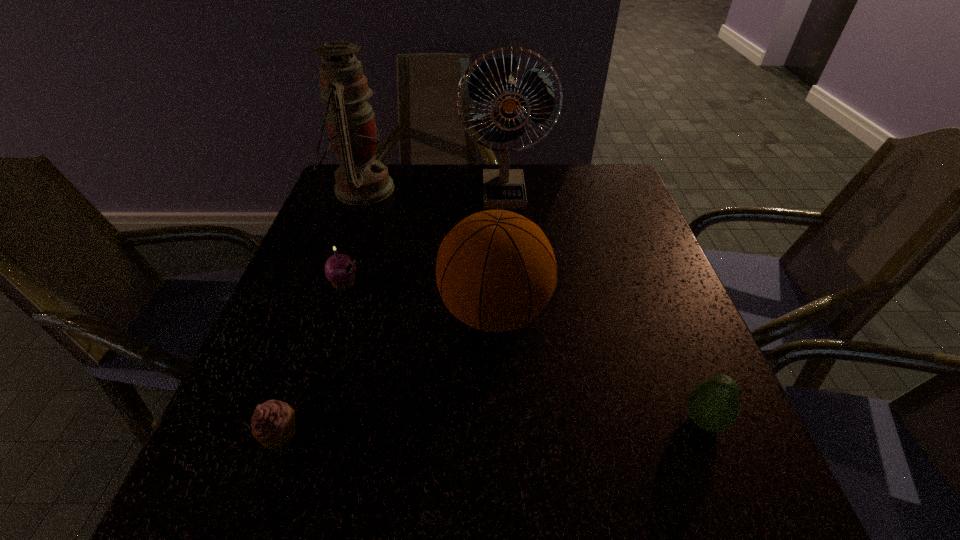
In the image, there is a desktop. Where is `vacant space at the left edge`? The image size is (960, 540). vacant space at the left edge is located at coordinates (308, 433).

Image resolution: width=960 pixels, height=540 pixels. In the image, there is a desktop. Find the location of `free space at the right edge`. free space at the right edge is located at coordinates (700, 342).

Where is `vacant area at the far left corner`? The height and width of the screenshot is (540, 960). vacant area at the far left corner is located at coordinates (335, 184).

In the image, there is a desktop. What are the coordinates of `vacant region at the far right corner` in the screenshot? It's located at (577, 193).

Find the location of a particular element. This screenshot has height=540, width=960. vacant point at the near right corner is located at coordinates pyautogui.click(x=757, y=475).

I want to click on free space between the basketball and the nearer cupcake, so click(387, 373).

You are a GUI agent. You are given a task and a screenshot of the screen. Output one action in this format:
    pyautogui.click(x=<x>, y=<y>)
    Task: Click on the free spot between the shorter cupcake and the fan
    The image size is (960, 540).
    Given the screenshot: What is the action you would take?
    pyautogui.click(x=392, y=313)

You are a GUI agent. You are given a task and a screenshot of the screen. Output one action in this format:
    pyautogui.click(x=<x>, y=<y>)
    Task: Click on the vacant space in between the basketball and the oil lamp
    This screenshot has height=540, width=960.
    Given the screenshot: What is the action you would take?
    pyautogui.click(x=428, y=251)

At what (x,y) coordinates should I click in order to perform the action: click on unoccupied position between the fan and the farther cupcake. Please return your answer as a coordinate pair (x, y). This screenshot has height=540, width=960. Looking at the image, I should click on (424, 238).

Find the location of a particular element. free spot between the farther cupcake and the oil lamp is located at coordinates (353, 236).